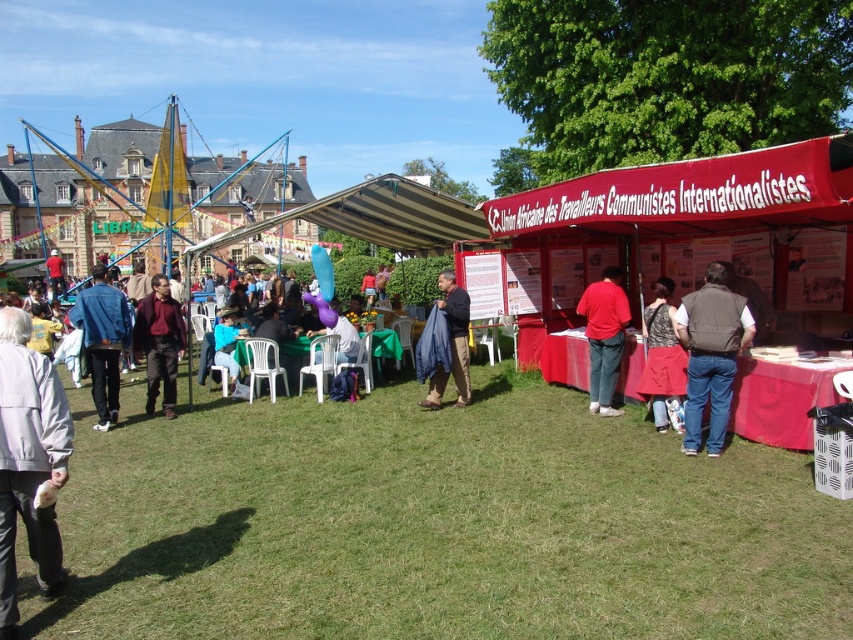
You are at the event and see both the red matte shirt at center and the dark gray fabric dress at center. From your perspective, which one is positioned to the left?

The red matte shirt at center is to the left of the dark gray fabric dress at center.

You are organizing a clothing donation drive and need to categorize items by size. You have a blue fabric jacket at center and a burgundy fabric shirt at center. Which item would you place in the small size bin?

The blue fabric jacket at center should be placed in the small size bin because its width is less than the burgundy fabric shirt at center.